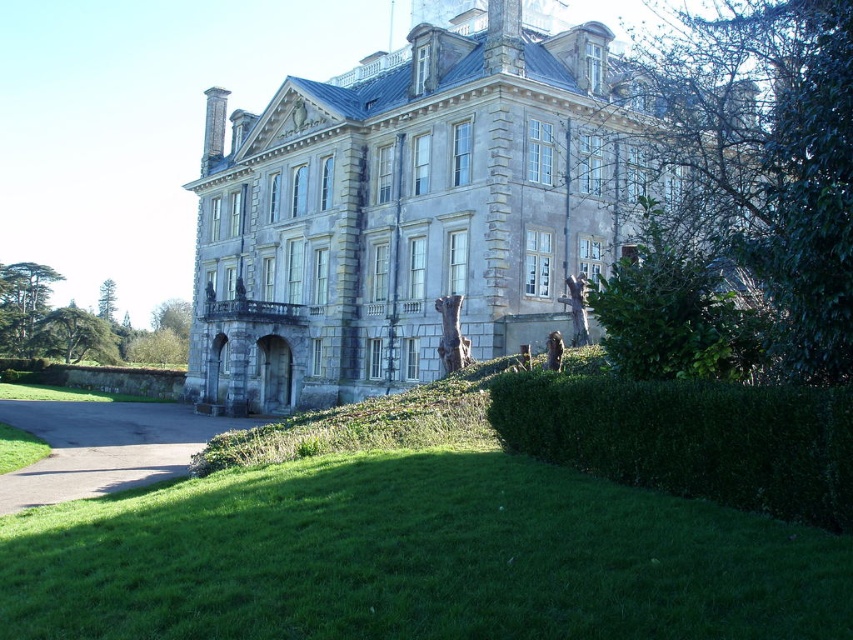
Can you confirm if green grass at lower center is positioned to the right of gray asphalt driveway at lower left?

Correct, you'll find green grass at lower center to the right of gray asphalt driveway at lower left.

Is point (102, 589) positioned after point (120, 432)?

That is False.

Does point (39, 570) come in front of point (10, 474)?

Yes, it is.

Where is `green grass at lower center`? The image size is (853, 640). green grass at lower center is located at coordinates (415, 557).

Consider the image. Can you confirm if green leafy hedge at lower right is taller than gray asphalt driveway at lower left?

Yes.

Identify the location of green leafy hedge at lower right. This screenshot has width=853, height=640. (689, 438).

Does gray stone palace at center have a lesser height compared to gray asphalt driveway at lower left?

In fact, gray stone palace at center may be taller than gray asphalt driveway at lower left.

At what (x,y) coordinates should I click in order to perform the action: click on gray stone palace at center. Please return your answer as a coordinate pair (x, y). Image resolution: width=853 pixels, height=640 pixels. Looking at the image, I should click on (416, 205).

Which is behind, point (602, 145) or point (61, 465)?

The point (602, 145) is more distant.

Where is `gray stone palace at center`? This screenshot has width=853, height=640. gray stone palace at center is located at coordinates (416, 205).